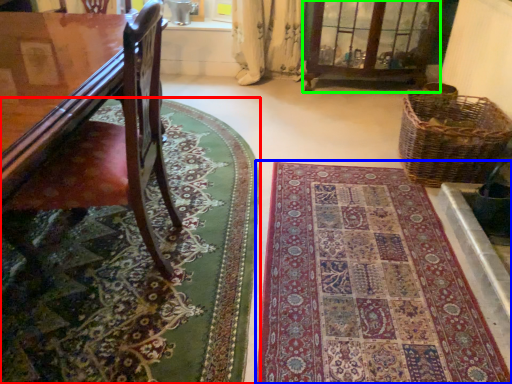
Question: Which is nearer to the mat (highlighted by a red box)? mat (highlighted by a blue box) or bay window (highlighted by a green box).

Choices:
 (A) mat
 (B) bay window

Answer: (A)